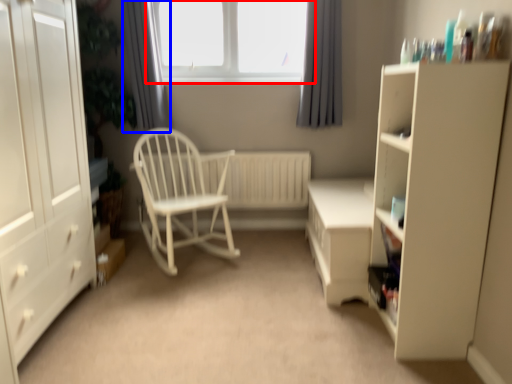
Question: Which object is further to the camera taking this photo, window (highlighted by a red box) or curtain (highlighted by a blue box)?

Choices:
 (A) window
 (B) curtain

Answer: (A)